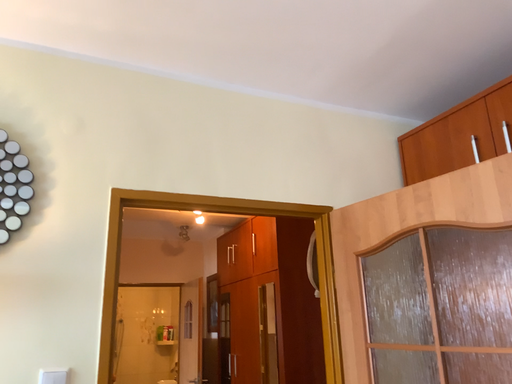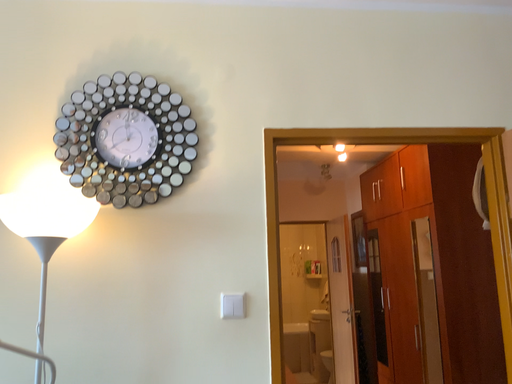
Question: How did the camera likely rotate when shooting the video?

Choices:
 (A) rotated right
 (B) rotated left

Answer: (B)